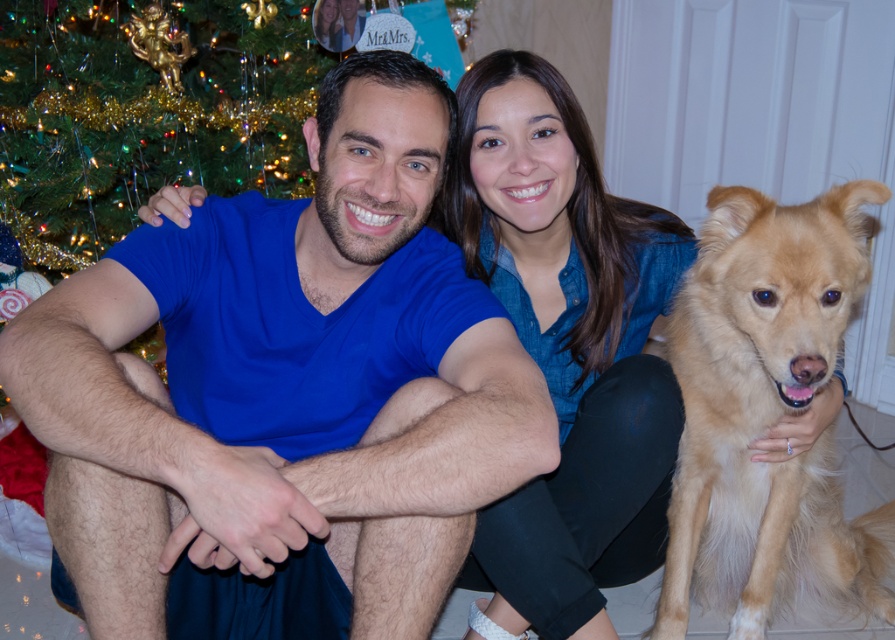
You are standing in front of the festive scene with the Christmas tree. You see a point labeled at coordinates (567, 346). What object in the scene corresponds to this point?

The point at coordinates (567, 346) corresponds to the denim shirt at center.

You are a photographer trying to capture a group photo of the blue matte shirt at center and the denim shirt at center. Since you want to ensure both are clearly visible, you need to adjust the camera focus. Which shirt should you focus on first to account for their sizes?

The blue matte shirt at center is larger than the denim shirt at center, so you should focus on the blue matte shirt at center first to ensure it is in sharp focus before adjusting for the smaller denim shirt at center.

You are a photographer taking a picture of the blue matte shirt at center and the denim shirt at center. Which shirt is closer to the camera?

The denim shirt at center is closer to the camera because the blue matte shirt at center is positioned under it.